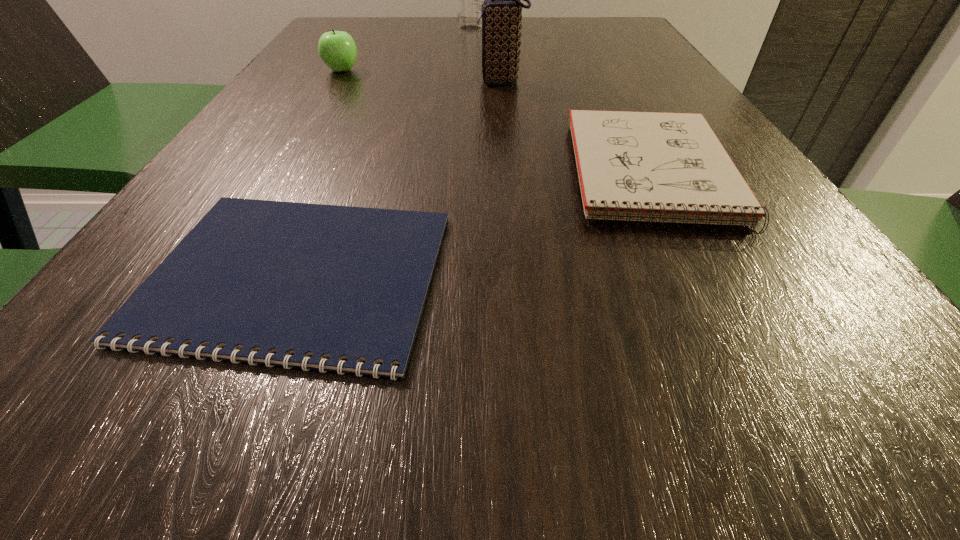
Locate an element on the screen. free space at the near edge of the desktop is located at coordinates [x=518, y=470].

Where is `blank area at the left edge`? Image resolution: width=960 pixels, height=540 pixels. blank area at the left edge is located at coordinates (300, 174).

The width and height of the screenshot is (960, 540). I want to click on free space at the right edge of the desktop, so click(x=678, y=84).

Find the location of a particular element. Image resolution: width=960 pixels, height=540 pixels. free region at the far right corner is located at coordinates coord(612,27).

This screenshot has width=960, height=540. What are the coordinates of `free space between the left notepad and the fourth shortest object` in the screenshot? It's located at (399, 179).

Image resolution: width=960 pixels, height=540 pixels. Identify the location of unoccupied position between the apple and the taller notepad. (496, 121).

You are a GUI agent. You are given a task and a screenshot of the screen. Output one action in this format:
    pyautogui.click(x=<x>, y=<y>)
    Task: Click on the free point between the apple and the fourth shortest object
    This screenshot has width=960, height=540.
    Given the screenshot: What is the action you would take?
    tap(421, 76)

Locate an element on the screen. The height and width of the screenshot is (540, 960). unoccupied position between the fourth shortest object and the shorter notepad is located at coordinates (399, 179).

The image size is (960, 540). I want to click on free space between the vodka and the apple, so click(x=406, y=50).

Where is `object that ranks as the second closest to the fourth tallest object`? The height and width of the screenshot is (540, 960). object that ranks as the second closest to the fourth tallest object is located at coordinates (257, 281).